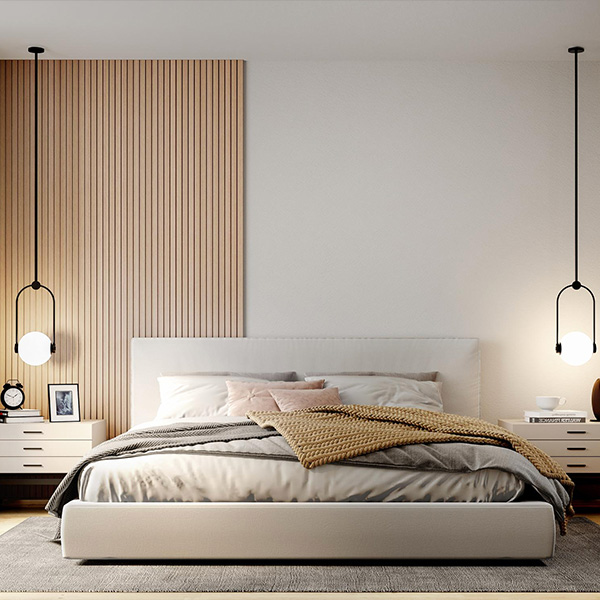
Where is `floor`? floor is located at coordinates (286, 597).